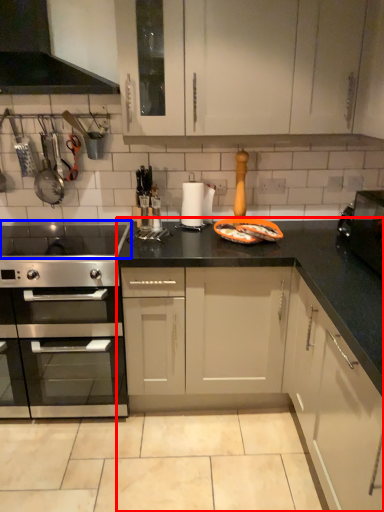
Question: Which object is further to the camera taking this photo, cabinetry (highlighted by a red box) or gas stove (highlighted by a blue box)?

Choices:
 (A) cabinetry
 (B) gas stove

Answer: (A)